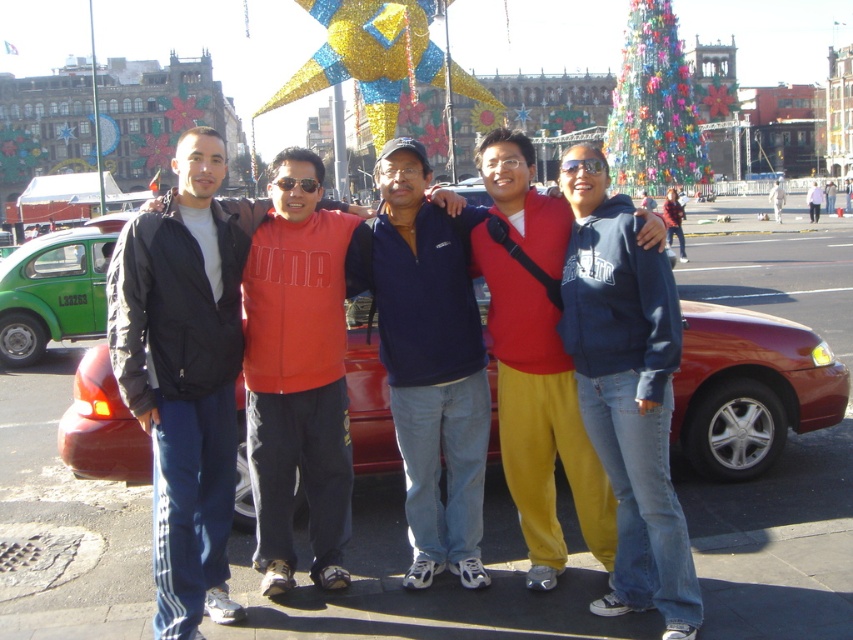
Does shiny red sedan at center have a smaller size compared to white matte jacket at center?

Yes, shiny red sedan at center is smaller than white matte jacket at center.

The image size is (853, 640). I want to click on shiny red sedan at center, so click(x=749, y=388).

Locate an element on the screen. This screenshot has height=640, width=853. shiny red sedan at center is located at coordinates (749, 388).

Does point (192, 237) lie in front of point (498, 362)?

That is True.

Which is above, black matte jacket at left or red fleece jacket at center?

Positioned higher is red fleece jacket at center.

Image resolution: width=853 pixels, height=640 pixels. What do you see at coordinates (184, 372) in the screenshot?
I see `black matte jacket at left` at bounding box center [184, 372].

Identify the location of black matte jacket at left. This screenshot has width=853, height=640. (184, 372).

Which is more to the left, black matte jacket at left or shiny red sedan at center?

Positioned to the left is black matte jacket at left.

Between point (173, 314) and point (759, 321), which one is positioned in front?

Point (173, 314) is in front.

Is point (218, 440) positioned after point (704, 380)?

No, it is in front of (704, 380).

Locate an element on the screen. The width and height of the screenshot is (853, 640). black matte jacket at left is located at coordinates [x=184, y=372].